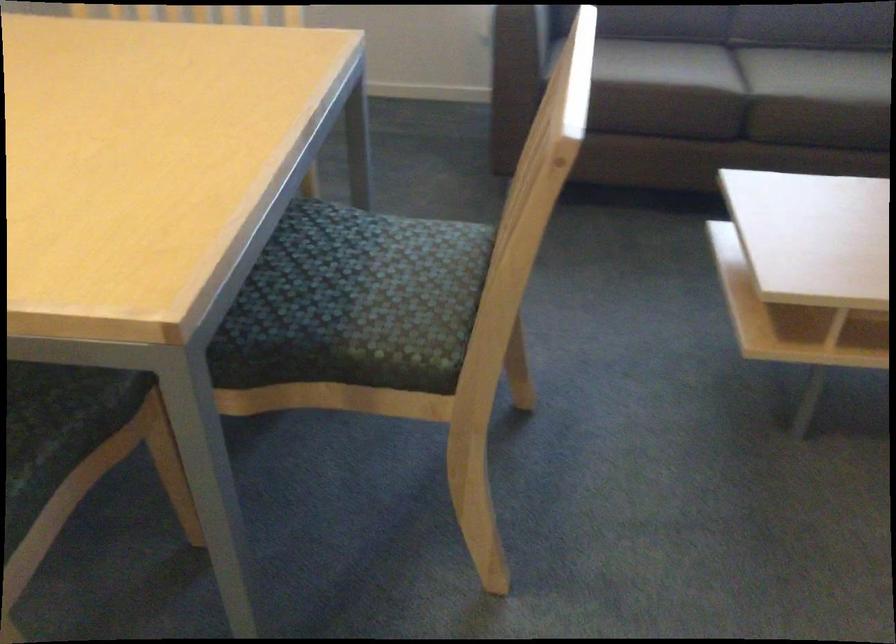
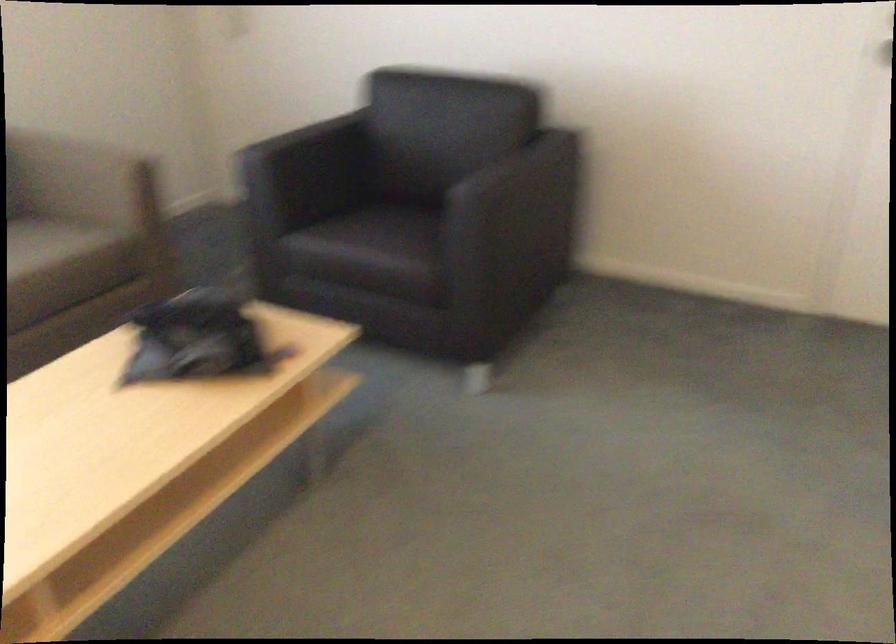
Question: How did the camera likely rotate?

Choices:
 (A) Left
 (B) Right
 (C) Up
 (D) Down

Answer: (B)